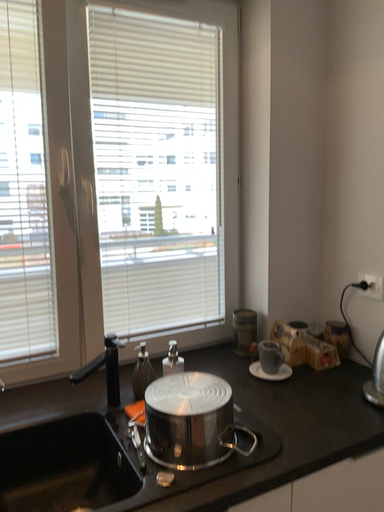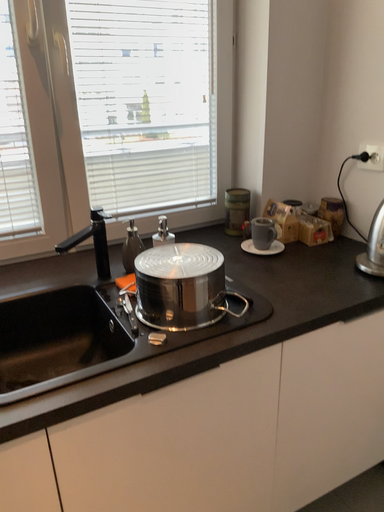
Question: Which way did the camera rotate in the video?

Choices:
 (A) rotated upward
 (B) rotated downward

Answer: (B)